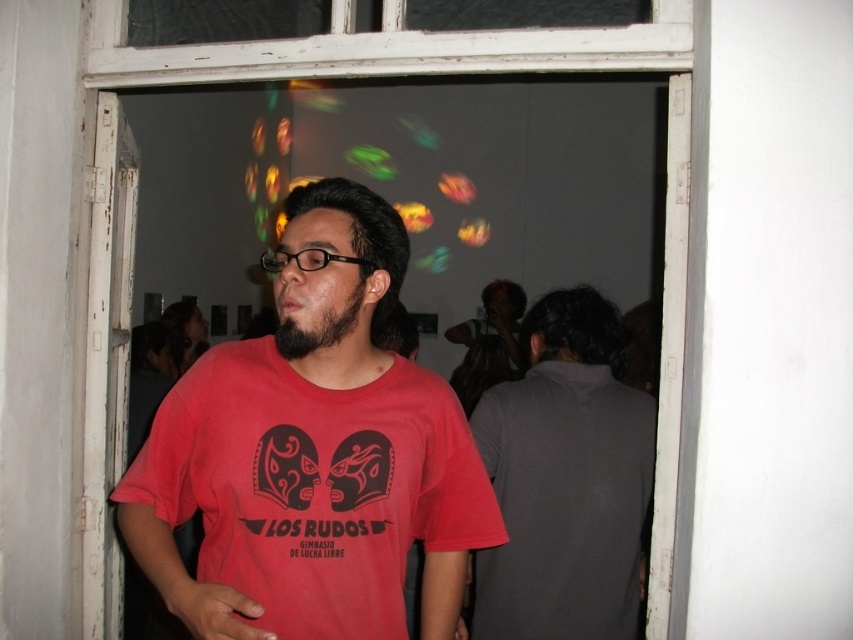
You are organizing a photo shoot and need to adjust lighting based on the subjects. The scene has a person in a dark gray shirt at right and another with a black fuzzy beard at center. Which subject should receive more focused lighting to ensure their features are adequately highlighted, considering their size in the frame?

The dark gray shirt at right has a larger size compared to the black fuzzy beard at center, so the subject in the dark gray shirt at right should receive more focused lighting to ensure their features are adequately highlighted due to their larger presence in the frame.